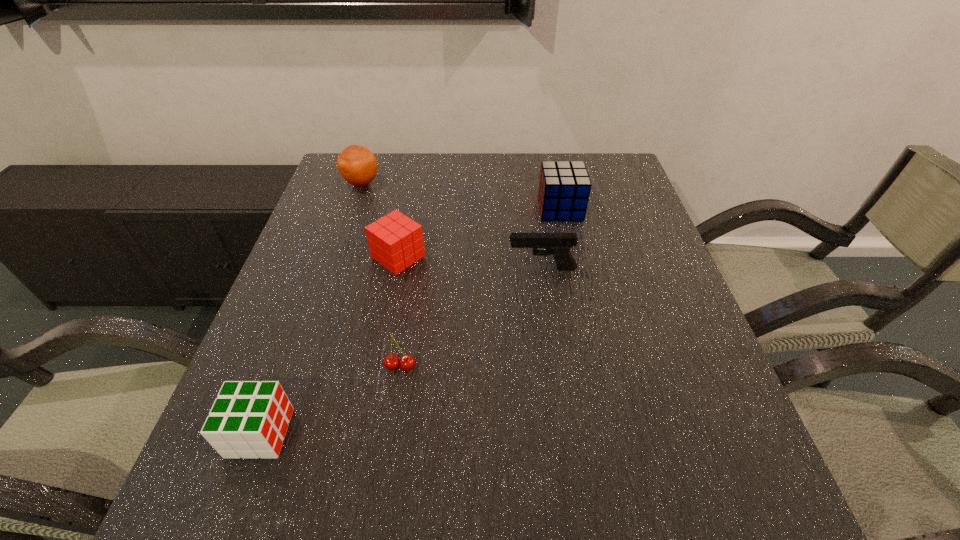
Identify the location of vacant space at the far edge of the desktop. This screenshot has width=960, height=540. (482, 177).

The width and height of the screenshot is (960, 540). Find the location of `vacant space at the near edge of the desktop`. vacant space at the near edge of the desktop is located at coordinates (487, 487).

You are a GUI agent. You are given a task and a screenshot of the screen. Output one action in this format:
    pyautogui.click(x=<x>, y=<y>)
    Task: Click on the vacant space at the left edge
    The height and width of the screenshot is (540, 960).
    Given the screenshot: What is the action you would take?
    pyautogui.click(x=329, y=373)

You are a GUI agent. You are given a task and a screenshot of the screen. Output one action in this format:
    pyautogui.click(x=<x>, y=<y>)
    Task: Click on the free space at the right edge of the desktop
    This screenshot has height=540, width=960.
    Given the screenshot: What is the action you would take?
    tap(608, 239)

The height and width of the screenshot is (540, 960). In order to click on vacant space at the far left corner of the desktop in this screenshot , I will do `click(339, 186)`.

You are a GUI agent. You are given a task and a screenshot of the screen. Output one action in this format:
    pyautogui.click(x=<x>, y=<y>)
    Task: Click on the vacant space at the near left corner of the desktop
    Image resolution: width=960 pixels, height=540 pixels.
    Given the screenshot: What is the action you would take?
    pyautogui.click(x=204, y=505)

I want to click on vacant space at the far right corner, so (621, 181).

Where is `free space between the pistol and the second cube from left to right`? The height and width of the screenshot is (540, 960). free space between the pistol and the second cube from left to right is located at coordinates (470, 262).

Find the location of `unoccupied position between the fifth nearest object and the orange`. unoccupied position between the fifth nearest object and the orange is located at coordinates (461, 195).

This screenshot has width=960, height=540. Identify the location of free space between the farthest object and the fifth farthest object. (381, 274).